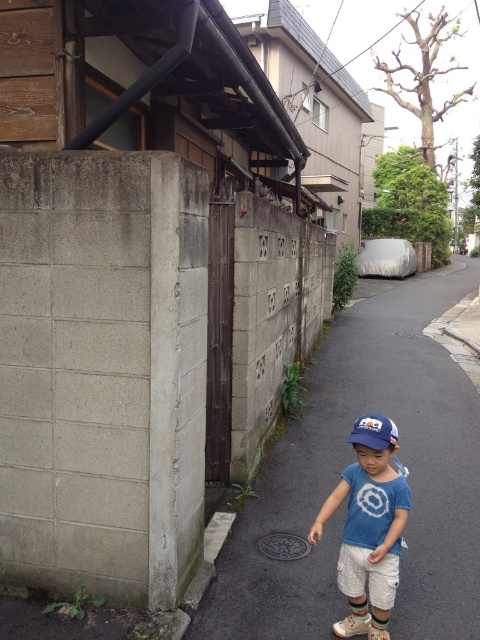
Question: Among these objects, which one is farthest from the camera?

Choices:
 (A) dark asphalt pavement at lower center
 (B) blue fabric baseball cap at center

Answer: (A)

Question: Where is dark asphalt pavement at lower center located in relation to blue fabric baseball cap at center in the image?

Choices:
 (A) left
 (B) right

Answer: (B)

Question: Which point is closer to the camera taking this photo?

Choices:
 (A) pos(347,440)
 (B) pos(457,547)
 (C) pos(369,445)

Answer: (C)

Question: Can you confirm if blue cotton shirt at center is wider than blue fabric baseball cap at center?

Choices:
 (A) no
 (B) yes

Answer: (B)

Question: Which object appears closest to the camera in this image?

Choices:
 (A) blue fabric baseball cap at center
 (B) dark asphalt pavement at lower center
 (C) blue cotton shirt at center

Answer: (C)

Question: Considering the relative positions of blue cotton shirt at center and blue fabric baseball cap at center in the image provided, where is blue cotton shirt at center located with respect to blue fabric baseball cap at center?

Choices:
 (A) above
 (B) below

Answer: (B)